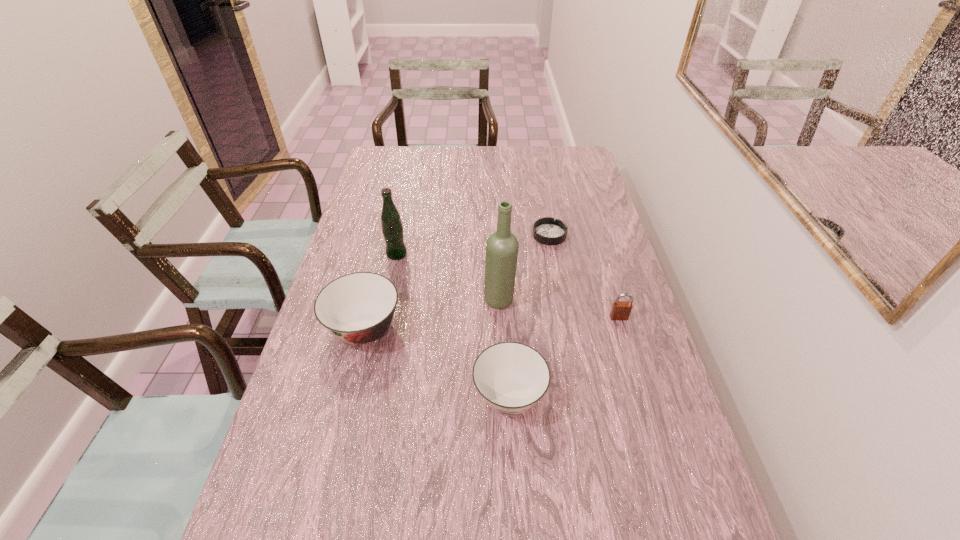
In the current image, all soup bowls are evenly spaced. To maintain this equal spacing, where should an additional soup bowl be placed on the right? Please point out a free spot. Please provide its 2D coordinates. Your answer should be formatted as a tuple, i.e. [(x, y)], where the tuple contains the x and y coordinates of a point satisfying the conditions above.

[(702, 484)]